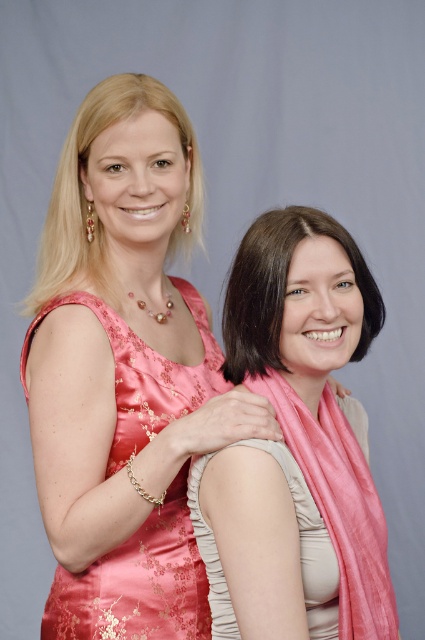
Question: In this image, where is pink silk scarf at right located relative to smooth brown hair at center?

Choices:
 (A) above
 (B) below

Answer: (B)

Question: Among these points, which one is farthest from the camera?

Choices:
 (A) (258, 500)
 (B) (365, 284)

Answer: (B)

Question: Which point appears farthest from the camera in this image?

Choices:
 (A) (193, 490)
 (B) (258, 321)
 (C) (116, 314)

Answer: (C)

Question: Which point is closer to the camera taking this photo?

Choices:
 (A) (282, 314)
 (B) (286, 557)
 (C) (159, 630)

Answer: (B)

Question: Does satin dress at left have a larger size compared to smooth brown hair at center?

Choices:
 (A) no
 (B) yes

Answer: (B)

Question: Where is satin dress at left located in relation to smooth brown hair at center in the image?

Choices:
 (A) above
 (B) below

Answer: (B)